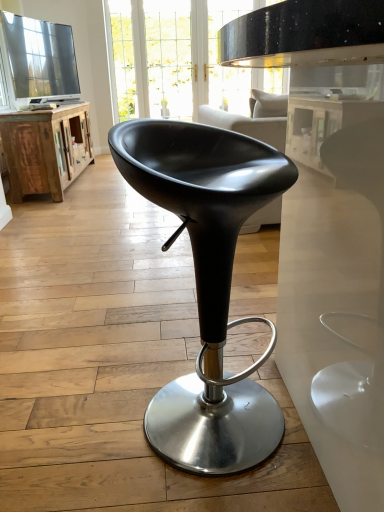
Question: Is point (28, 163) closer or farther from the camera than point (114, 117)?

Choices:
 (A) closer
 (B) farther

Answer: (A)

Question: Is rustic wood cabinet at left taller or shorter than clear glass door at upper center?

Choices:
 (A) tall
 (B) short

Answer: (B)

Question: Which of these objects is positioned farthest from the black leather stool at center?

Choices:
 (A) rustic wood cabinet at left
 (B) clear glass door at upper center

Answer: (B)

Question: Which is nearer to the rustic wood cabinet at left?

Choices:
 (A) black leather stool at center
 (B) clear glass door at upper center

Answer: (B)